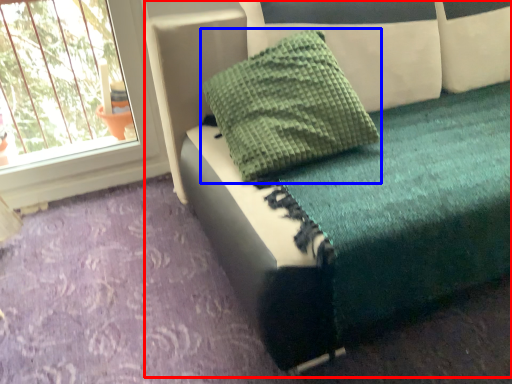
Question: Among these objects, which one is nearest to the camera, furniture (highlighted by a red box) or pillow (highlighted by a blue box)?

Choices:
 (A) furniture
 (B) pillow

Answer: (A)